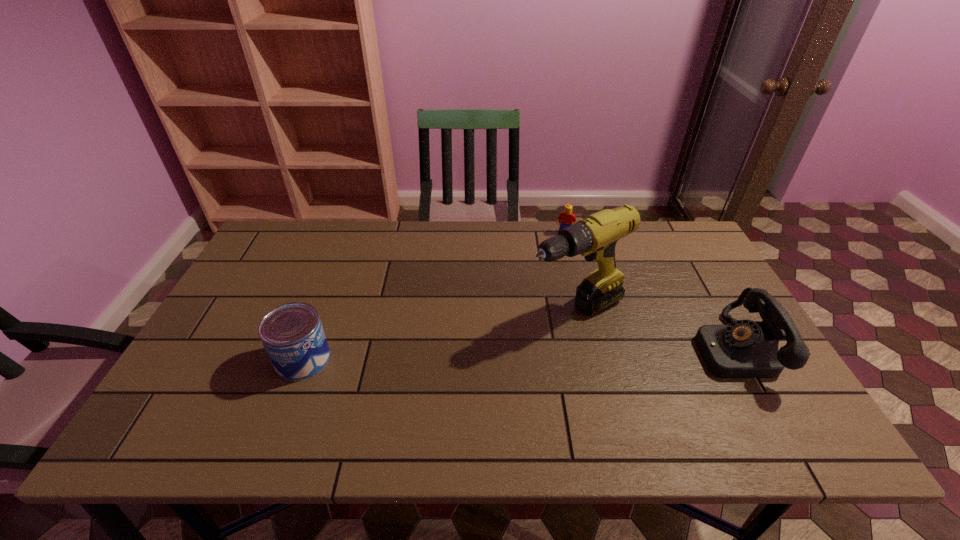
What are the coordinates of `free spot between the Lego and the telephone` in the screenshot? It's located at (648, 291).

Find the location of a particular element. The width and height of the screenshot is (960, 540). vacant area that lies between the farthest object and the rightmost object is located at coordinates (648, 291).

Where is `free space between the farthest object and the drill`? This screenshot has width=960, height=540. free space between the farthest object and the drill is located at coordinates (570, 272).

Find the location of a particular element. The height and width of the screenshot is (540, 960). unoccupied position between the drill and the can is located at coordinates (439, 335).

Find the location of a particular element. The width and height of the screenshot is (960, 540). vacant region between the tallest object and the Lego is located at coordinates point(570,272).

This screenshot has width=960, height=540. Find the location of `free space between the rightmost object and the farthest object`. free space between the rightmost object and the farthest object is located at coordinates (648, 291).

In order to click on object that stands as the third closest to the third tallest object in this screenshot , I will do `click(744, 349)`.

Find the location of `object that stands as the closest to the farthest object`. object that stands as the closest to the farthest object is located at coordinates (595, 237).